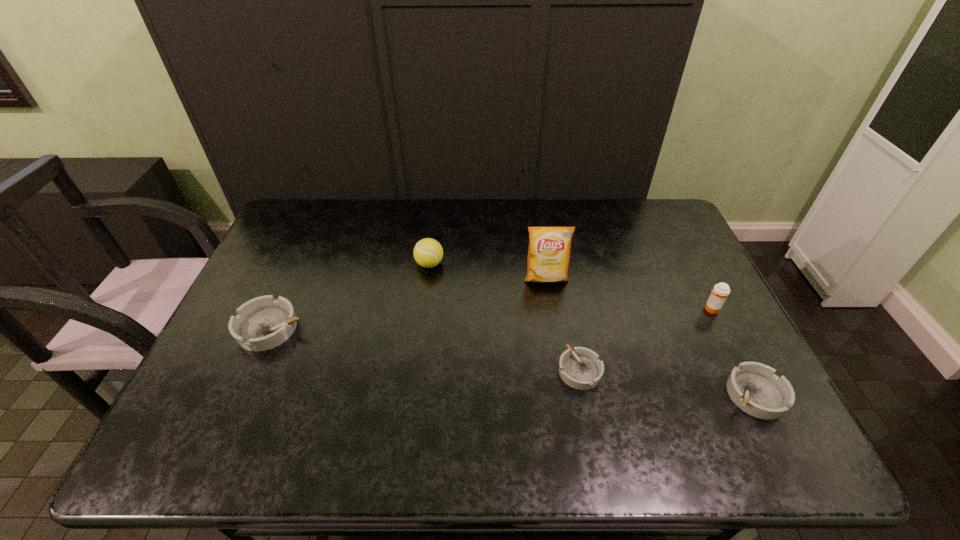
Locate an element on the screen. This screenshot has width=960, height=540. free spot that satisfies the following two spatial constraints: 1. on the front-facing side of the crisp (potato chip); 2. on the left side of the second ashtray from right to left is located at coordinates (560, 370).

The image size is (960, 540). Find the location of `free location that satisfies the following two spatial constraints: 1. on the front side of the second shortest object; 2. on the right side of the second object from left to right`. free location that satisfies the following two spatial constraints: 1. on the front side of the second shortest object; 2. on the right side of the second object from left to right is located at coordinates (414, 394).

Locate an element on the screen. This screenshot has width=960, height=540. blank space that satisfies the following two spatial constraints: 1. on the front-facing side of the tallest object; 2. on the left side of the medicine is located at coordinates (550, 309).

The width and height of the screenshot is (960, 540). Identify the location of vacant area that satisfies the following two spatial constraints: 1. on the front-facing side of the crisp (potato chip); 2. on the right side of the rightmost ashtray. (564, 394).

Where is `vacant space that satisfies the following two spatial constraints: 1. on the front side of the shortest ashtray; 2. on the left side of the rightmost ashtray`? vacant space that satisfies the following two spatial constraints: 1. on the front side of the shortest ashtray; 2. on the left side of the rightmost ashtray is located at coordinates (585, 394).

The height and width of the screenshot is (540, 960). I want to click on free location that satisfies the following two spatial constraints: 1. on the front-facing side of the rightmost ashtray; 2. on the left side of the tallest object, so click(564, 394).